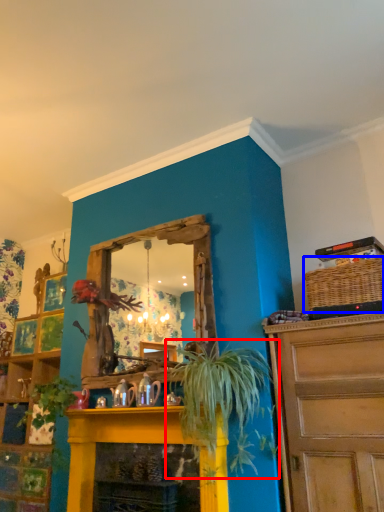
Question: Which object appears closest to the camera in this image, houseplant (highlighted by a red box) or basket (highlighted by a blue box)?

Choices:
 (A) houseplant
 (B) basket

Answer: (A)